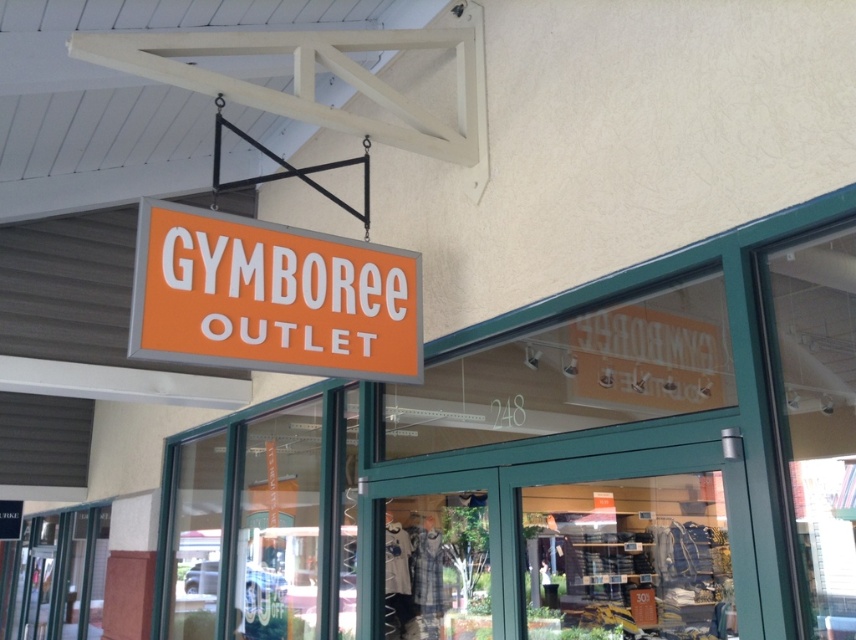
You are standing in front of the Gymboree Outlet store. Where is the orange matte sign at upper center located?

The orange matte sign at upper center is located at point (271, 298).

You are a delivery person approaching the Gymboree Outlet store and need to hand over a package to the staff. The orange matte sign at upper center and the transparent glass door at center are in your line of sight. Which object should you look at first to locate the entrance?

The transparent glass door at center is farther away from you than the orange matte sign at upper center. Therefore, the entrance is likely through the transparent glass door at center, which is further back, but since the sign is closer, you should look at the sign first to confirm the store entrance location.